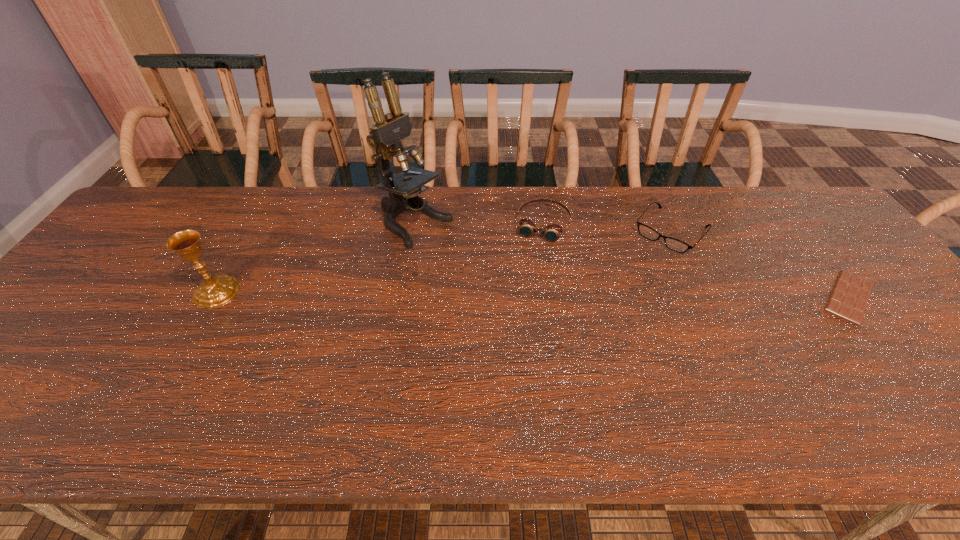
Identify the location of vacant space on the desktop that is between the leftmost object and the chocolate bar and is positioned on the front-facing side of the spectacles. This screenshot has width=960, height=540. (616, 295).

I want to click on vacant space on the desktop that is between the leftmost object and the chocolate bar and is positioned at the eyepieces of the tallest object, so click(524, 294).

Locate an element on the screen. The height and width of the screenshot is (540, 960). free space on the desktop that is between the second tallest object and the chocolate bar and is positioned through the lenses of the third tallest object is located at coordinates (520, 294).